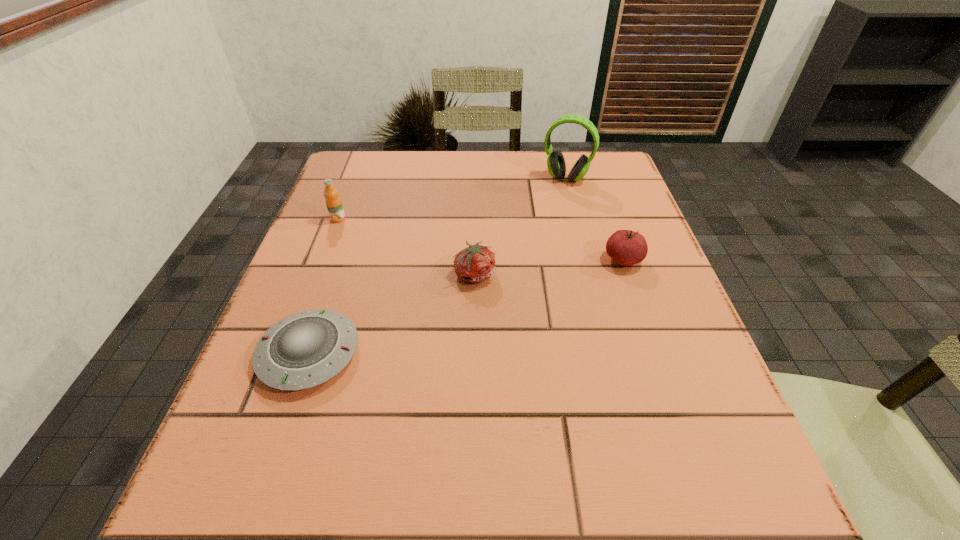
This screenshot has width=960, height=540. What are the coordinates of `vacant space located 0.060m on the left of the right tomato` in the screenshot? It's located at (575, 260).

I want to click on vacant region located on the right of the third object from right to left, so click(661, 274).

Find the location of a particular element. Image resolution: width=960 pixels, height=540 pixels. vacant space located 0.170m on the right of the shortest object is located at coordinates (458, 354).

Locate an element on the screen. The height and width of the screenshot is (540, 960). object situated at the far edge is located at coordinates (556, 165).

This screenshot has width=960, height=540. I want to click on orange juice located in the left edge section of the desktop, so click(x=333, y=202).

Where is `saucer at the left edge`? saucer at the left edge is located at coordinates (308, 348).

This screenshot has width=960, height=540. I want to click on headset at the right edge, so click(556, 165).

Locate an element on the screen. The height and width of the screenshot is (540, 960). tomato present at the right edge is located at coordinates (626, 247).

At what (x,y) coordinates should I click in order to perform the action: click on object that is at the far right corner. Please return your answer as a coordinate pair (x, y). The image size is (960, 540). Looking at the image, I should click on (556, 165).

The width and height of the screenshot is (960, 540). What are the coordinates of `vacant region at the far edge of the desktop` in the screenshot? It's located at (504, 157).